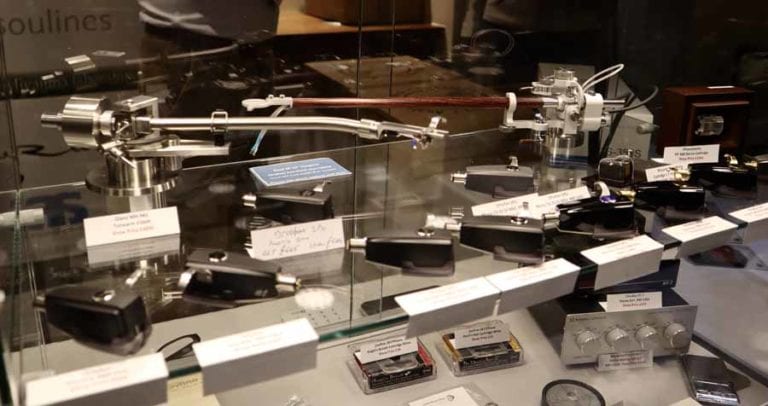
The height and width of the screenshot is (406, 768). In order to click on floor in this screenshot , I will do coord(293,19).